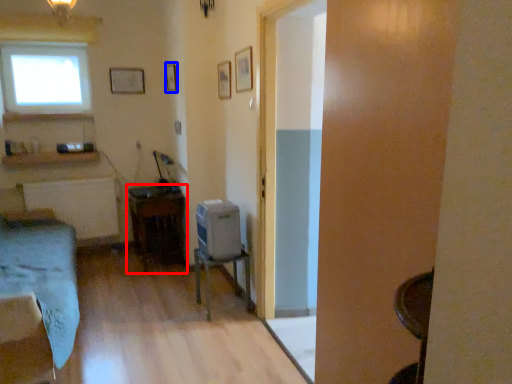
Question: Among these objects, which one is nearest to the camera, table (highlighted by a red box) or picture frame (highlighted by a blue box)?

Choices:
 (A) table
 (B) picture frame

Answer: (A)